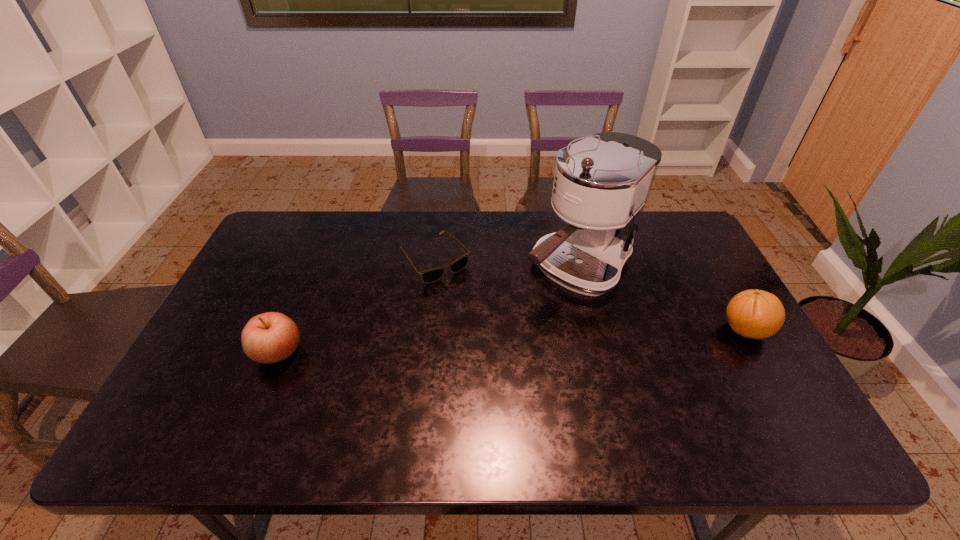
Find the location of a particular element. The image size is (960, 540). vacant space at the left edge of the desktop is located at coordinates (255, 302).

This screenshot has height=540, width=960. In the image, there is a desktop. Identify the location of blank space at the right edge. (717, 305).

Image resolution: width=960 pixels, height=540 pixels. Find the location of `vacant space at the far left corner`. vacant space at the far left corner is located at coordinates [278, 233].

In the image, there is a desktop. Where is `free space at the far right corner`? The width and height of the screenshot is (960, 540). free space at the far right corner is located at coordinates 699,243.

Find the location of a particular element. This screenshot has width=960, height=540. vacant area that lies between the orange and the leftmost object is located at coordinates (512, 341).

Where is `vacant point located between the shortest object and the coffee maker`? vacant point located between the shortest object and the coffee maker is located at coordinates (507, 265).

The width and height of the screenshot is (960, 540). What are the coordinates of `vacant space that's between the orange and the leftmost object` in the screenshot? It's located at pyautogui.click(x=512, y=341).

Find the location of `free space between the apple and the orange`. free space between the apple and the orange is located at coordinates (512, 341).

The width and height of the screenshot is (960, 540). I want to click on vacant area that lies between the apple and the rightmost object, so click(512, 341).

Find the location of a particular element. The image size is (960, 540). empty space that is in between the rightmost object and the leftmost object is located at coordinates (512, 341).